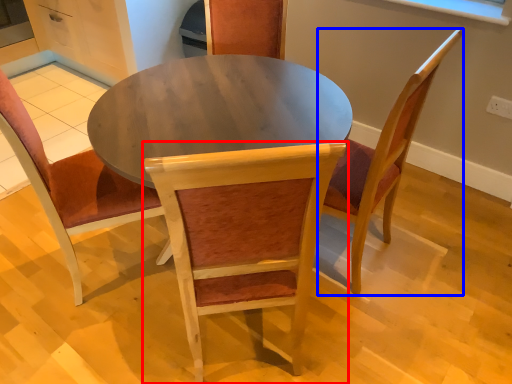
Question: Among these objects, which one is farthest to the camera, chair (highlighted by a red box) or chair (highlighted by a blue box)?

Choices:
 (A) chair
 (B) chair

Answer: (B)